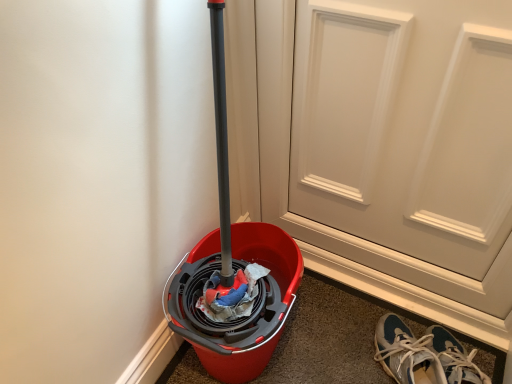
Find the location of a particular element. Image resolution: width=512 pixels, height=384 pixels. free space behind blue suede sneakers at lower right is located at coordinates (373, 307).